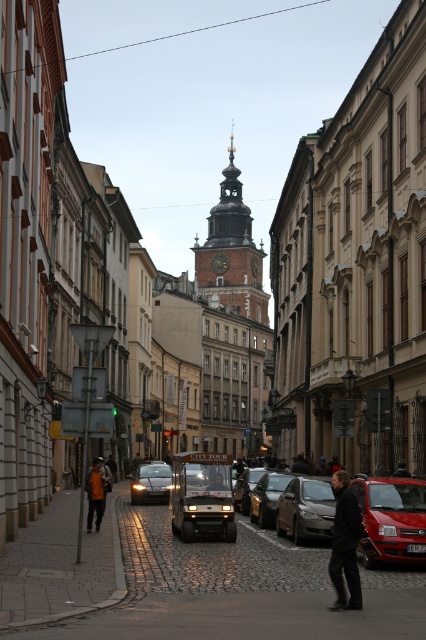
Does shiny silver car at center have a lesser height compared to dark brown leather jacket at center?

In fact, shiny silver car at center may be taller than dark brown leather jacket at center.

Locate an element on the screen. Image resolution: width=426 pixels, height=640 pixels. shiny silver car at center is located at coordinates (150, 483).

Where is `shiny silver car at center`? The height and width of the screenshot is (640, 426). shiny silver car at center is located at coordinates (x=150, y=483).

Which of these two, shiny red car at lower right or shiny metallic car at center, stands shorter?

shiny metallic car at center is shorter.

Does shiny red car at lower right have a smaller size compared to shiny metallic car at center?

No, shiny red car at lower right is not smaller than shiny metallic car at center.

Is point (423, 486) positioned in front of point (268, 497)?

Yes, point (423, 486) is closer to viewer.

This screenshot has width=426, height=640. What are the coordinates of `shiny red car at lower right` in the screenshot? It's located at (393, 516).

Does metallic silver car at center have a larger size compared to shiny red car at lower right?

Yes.

Can you confirm if metallic silver car at center is wider than shiny red car at lower right?

Yes, metallic silver car at center is wider than shiny red car at lower right.

Between point (293, 509) and point (394, 545), which one is positioned in front?

Point (394, 545) is more forward.

Locate an element on the screen. metallic silver car at center is located at coordinates (389, 515).